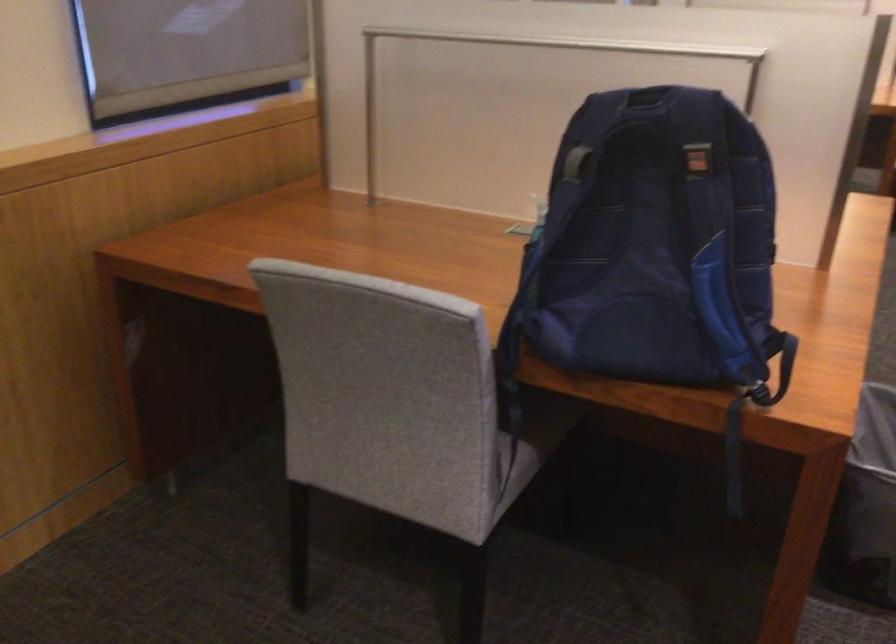
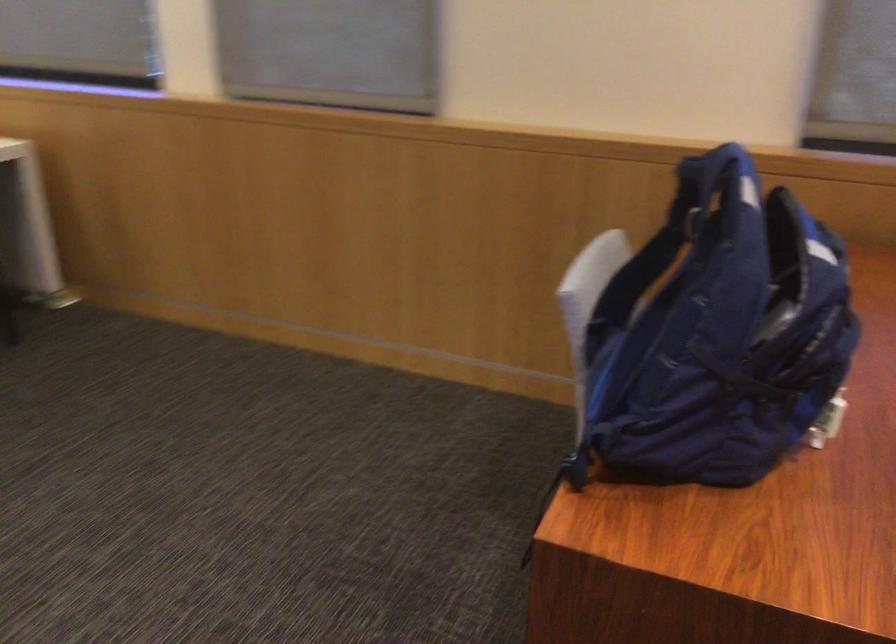
Locate, in the second image, the point that corresponds to [690,108] in the first image.

(730, 178)